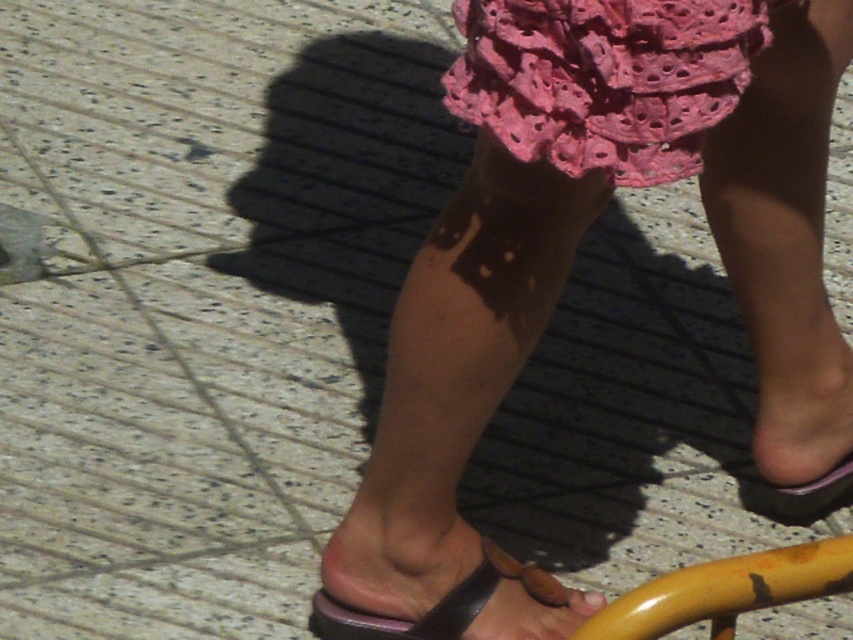
Based on the scene description, which object is positioned higher up on the person, the pink lace dress at upper center or the black leather sandal at lower center?

The pink lace dress at upper center is positioned higher up on the person than the black leather sandal at lower center, as it is located above the sandal.

You are a fashion stylist helping someone choose an outfit. They have the pink lace dress at upper center and the black leather sandal at lower center. Based on their spatial arrangement in the image, which item is located to the right of the other?

The pink lace dress at upper center is positioned on the right side of the black leather sandal at lower center.

You are standing 1.84 meters away from the point marked at coordinates (770,4). If you want to place a 1.5 meter long pole horizontally between yourself and that point, will it fit without overlapping the yellow object at the bottom right corner?

The distance between you and the point is exactly 1.84 meters. The pole is 1.5 meters long, so there will be 0.34 meters of space remaining. Since the yellow object at the bottom right corner is not mentioned in the Objects Description, we cannot confirm its position relative to the pole. However, the pole itself would fit within the distance, but potential overlap with the yellow object cannot be determined without additional information.